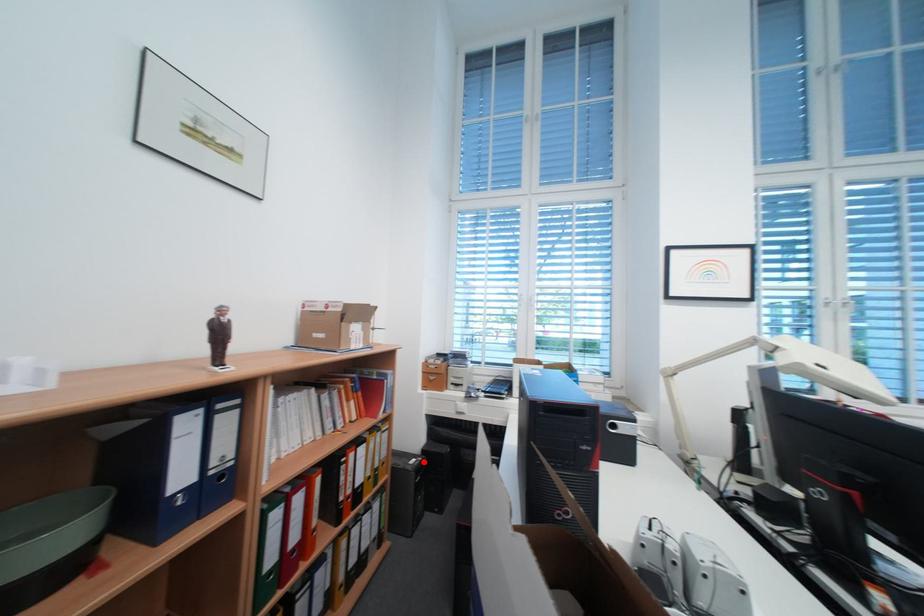
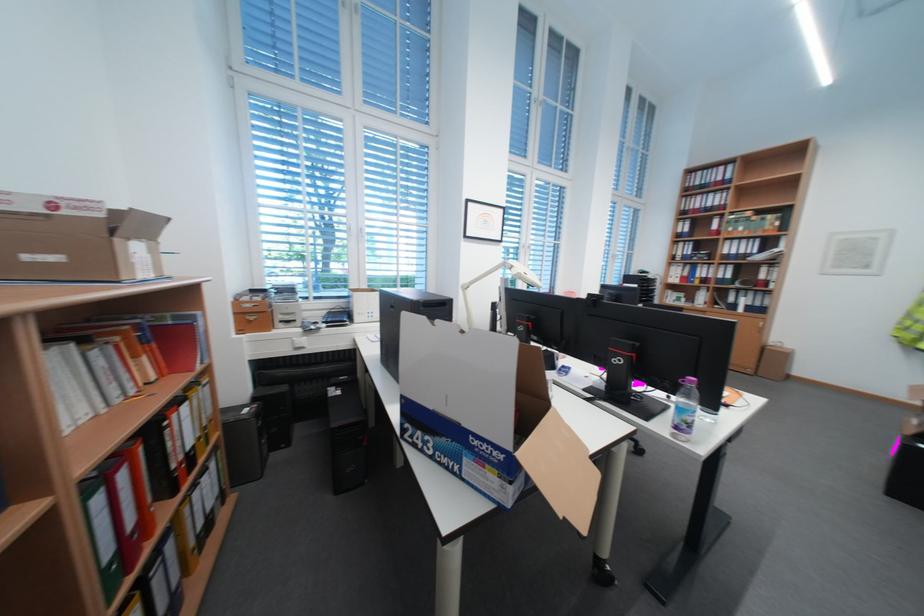
The point at the highlighted location is marked in the first image. Where is the corresponding point in the second image?

(257, 411)